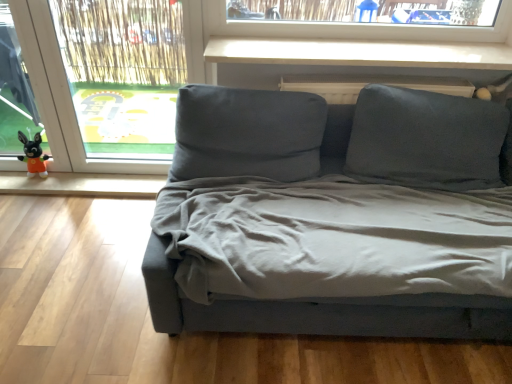
What do you see at coordinates (60, 94) in the screenshot? This screenshot has height=384, width=512. I see `transparent plastic window screen at left` at bounding box center [60, 94].

Locate an element on the screen. The image size is (512, 384). transparent plastic window screen at left is located at coordinates (60, 94).

Where is `transparent plastic window screen at left`? transparent plastic window screen at left is located at coordinates (60, 94).